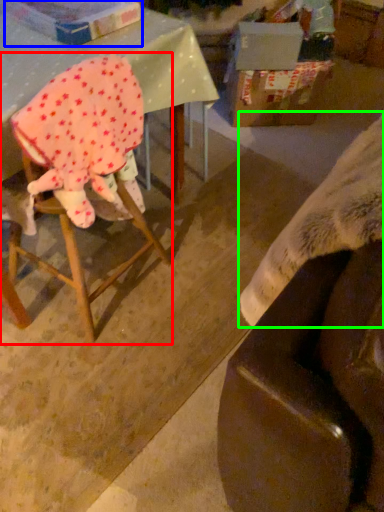
Question: Considering the real-world distances, which object is closest to chair (highlighted by a red box)? cardboard box (highlighted by a blue box) or blanket (highlighted by a green box).

Choices:
 (A) cardboard box
 (B) blanket

Answer: (A)